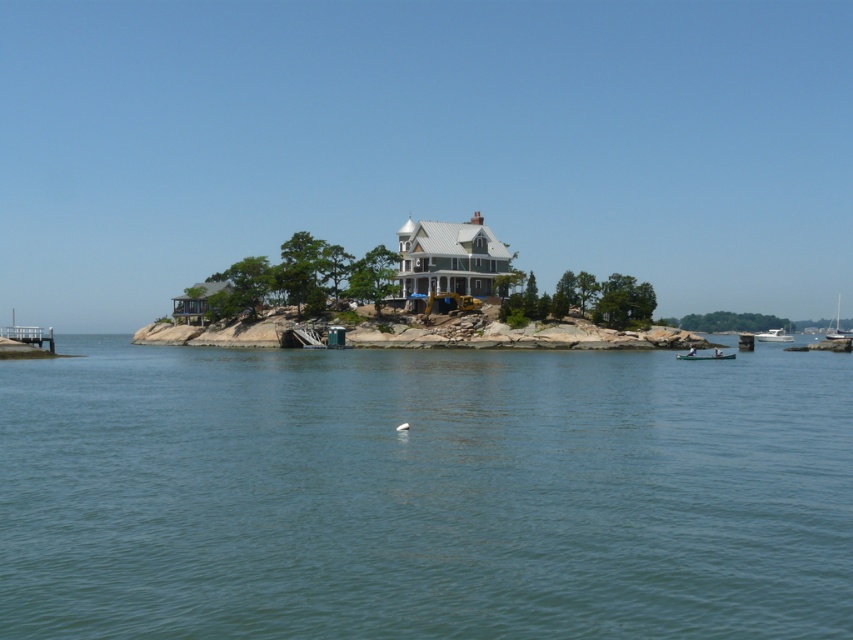
You are standing on the pier and want to reach the white matte bird at center. Is the wooden canoe at lower right blocking your path?

The wooden canoe at lower right is above the white matte bird at center, so the canoe is positioned higher up and might not directly block the path to the bird. However, since the canoe is at the lower right, it could still be in the way depending on your route. Please check the exact positioning.

You are a photographer planning to capture a sunset scene from the pier. You notice the white sailboat at right and the white matte bird at center in your viewfinder. Which object will appear larger in your photo?

The white sailboat at right will appear larger in the photo because it is much taller than the white matte bird at center.